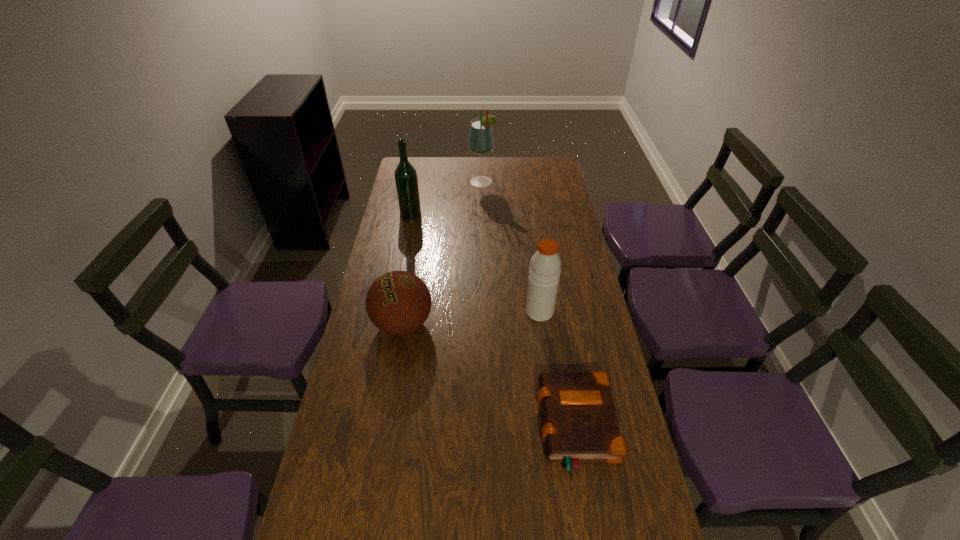
The image size is (960, 540). What are the coordinates of `the farther alcohol` in the screenshot? It's located at (481, 140).

This screenshot has width=960, height=540. Identify the location of the right alcohol. (481, 140).

Find the location of a particular element. The height and width of the screenshot is (540, 960). the fourth nearest object is located at coordinates (406, 180).

Image resolution: width=960 pixels, height=540 pixels. Identify the location of the left alcohol. (406, 180).

Where is `shaker`? The image size is (960, 540). shaker is located at coordinates (545, 266).

This screenshot has height=540, width=960. Find the location of `the second shortest object`. the second shortest object is located at coordinates (398, 302).

Find the location of `Bible`. Bible is located at coordinates (580, 424).

Locate an element on the screen. The image size is (960, 540). the shortest object is located at coordinates (580, 424).

Where is `vacant region located on the front of the right alcohol`? The image size is (960, 540). vacant region located on the front of the right alcohol is located at coordinates (483, 198).

Where is `vacant space located 0.090m on the right of the left alcohol`? The image size is (960, 540). vacant space located 0.090m on the right of the left alcohol is located at coordinates (442, 213).